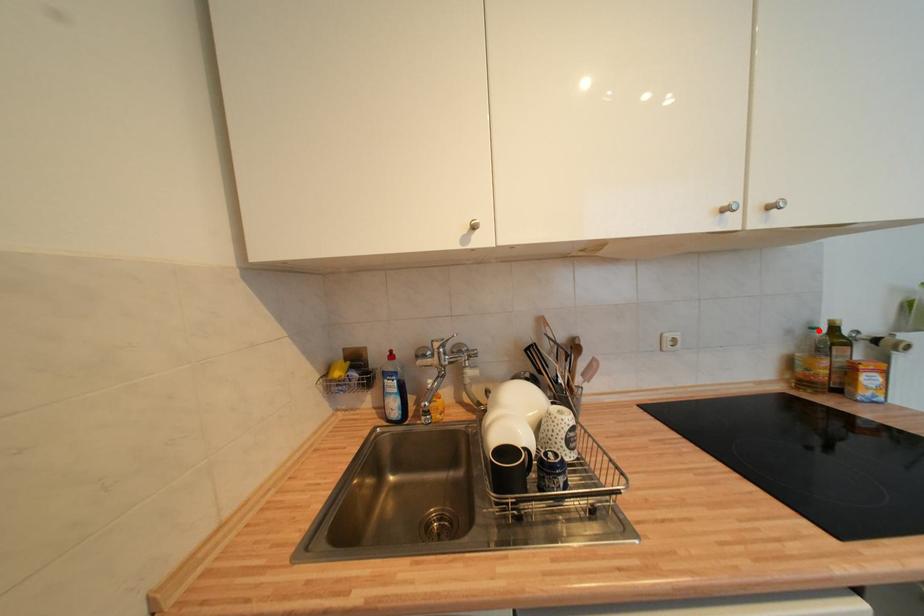
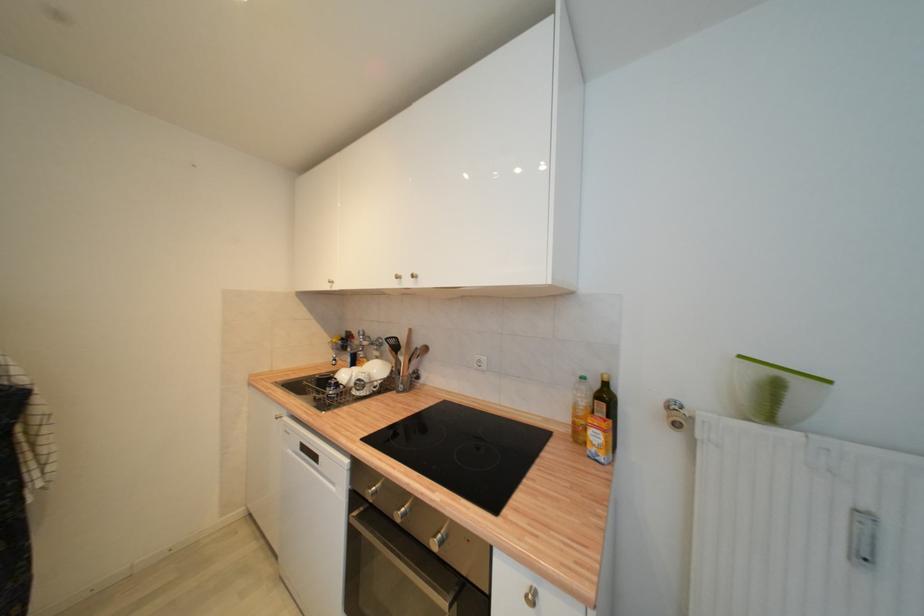
Find the pixel in the second image that matches the highlighted location in the first image.

(586, 379)